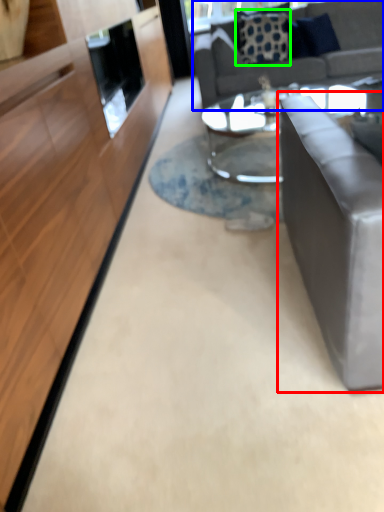
Question: Considering the real-world distances, which object is farthest from studio couch (highlighted by a red box)? studio couch (highlighted by a blue box) or pillow (highlighted by a green box)?

Choices:
 (A) studio couch
 (B) pillow

Answer: (B)